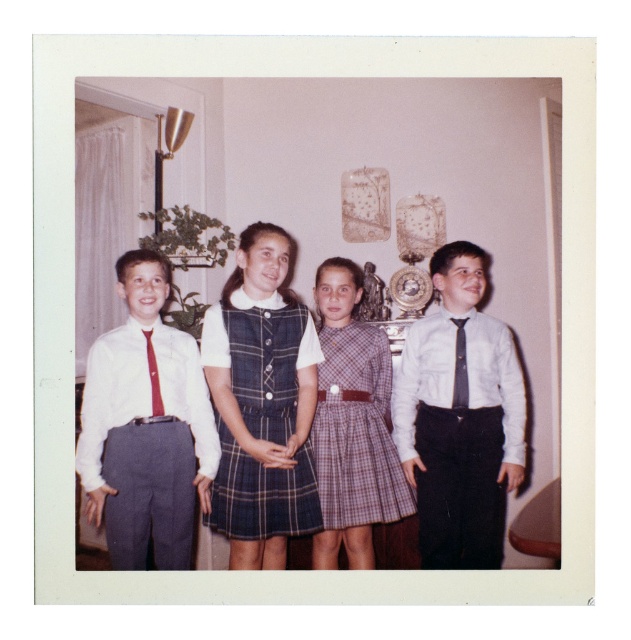
Which of these two, matte gray pants at left or red satin tie at left, stands shorter?

Standing shorter between the two is red satin tie at left.

Does point (201, 416) come closer to viewer compared to point (155, 369)?

No, (201, 416) is behind (155, 369).

Locate an element on the screen. matte gray pants at left is located at coordinates (143, 392).

Is matte gray pants at left to the right of gray textured tie at right from the viewer's perspective?

No, matte gray pants at left is not to the right of gray textured tie at right.

Can you confirm if matte gray pants at left is wider than gray textured tie at right?

Correct, the width of matte gray pants at left exceeds that of gray textured tie at right.

What are the coordinates of `matte gray pants at left` in the screenshot? It's located at (143, 392).

Can you confirm if plaid wool dress at center is taller than red satin tie at left?

Yes.

Does plaid wool dress at center have a larger size compared to red satin tie at left?

Yes.

Is point (312, 349) closer to camera compared to point (148, 349)?

No, (312, 349) is behind (148, 349).

Where is `plaid wool dress at center`? plaid wool dress at center is located at coordinates (261, 358).